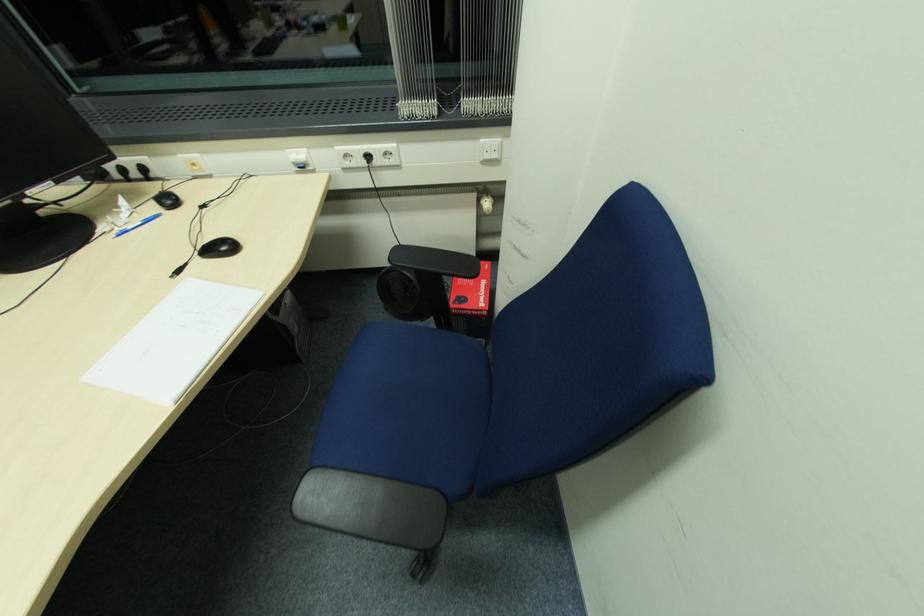
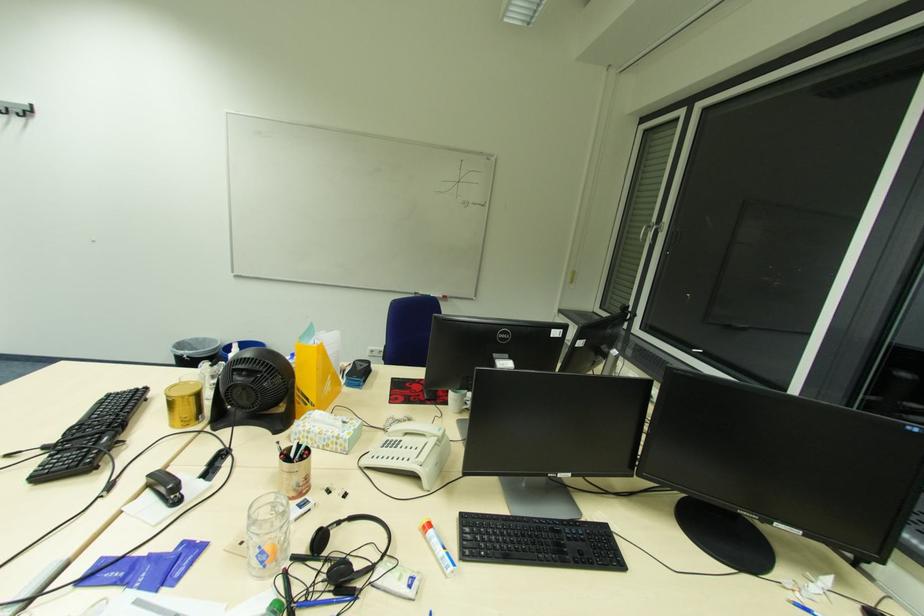
Question: How did the camera likely rotate?

Choices:
 (A) Left
 (B) Right
 (C) Up
 (D) Down

Answer: (A)